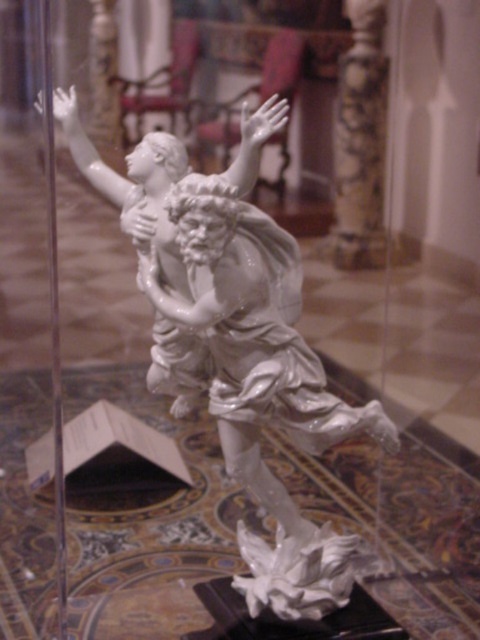
Does white glossy statue at center have a lesser height compared to white marble column at center?

Yes.

Which is behind, point (169, 284) or point (354, 161)?

The point (354, 161) is behind.

Is point (183, 298) behind point (334, 244)?

No, (183, 298) is closer to viewer.

You are a GUI agent. You are given a task and a screenshot of the screen. Output one action in this format:
    pyautogui.click(x=<x>, y=<y>)
    Task: Click on the white glossy statue at center
    This screenshot has width=480, height=640.
    Given the screenshot: What is the action you would take?
    pyautogui.click(x=133, y=186)